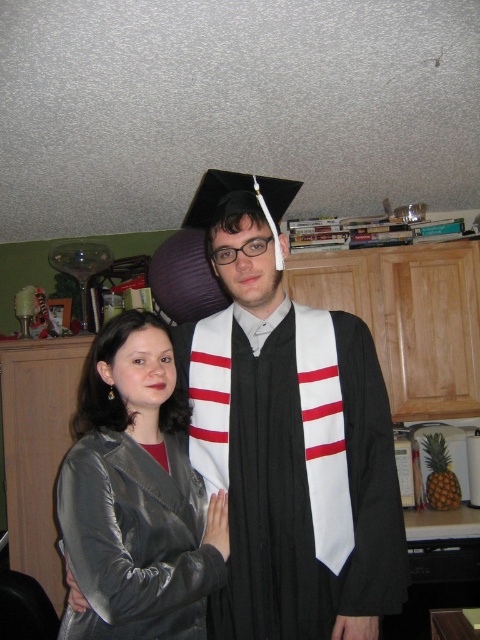
Question: Which of the following is the closest to the observer?

Choices:
 (A) black matte graduation gown at center
 (B) satin silver jacket at center

Answer: (B)

Question: Can you confirm if black matte graduation gown at center is positioned above satin silver jacket at center?

Choices:
 (A) no
 (B) yes

Answer: (B)

Question: Can you confirm if black matte graduation gown at center is positioned to the left of satin silver jacket at center?

Choices:
 (A) yes
 (B) no

Answer: (B)

Question: Does black matte graduation gown at center have a lesser width compared to satin silver jacket at center?

Choices:
 (A) yes
 (B) no

Answer: (B)

Question: Which of the following is the farthest from the observer?

Choices:
 (A) (87, 596)
 (B) (252, 352)

Answer: (B)

Question: Which point is farther to the camera?

Choices:
 (A) satin silver jacket at center
 (B) black matte graduation gown at center

Answer: (B)